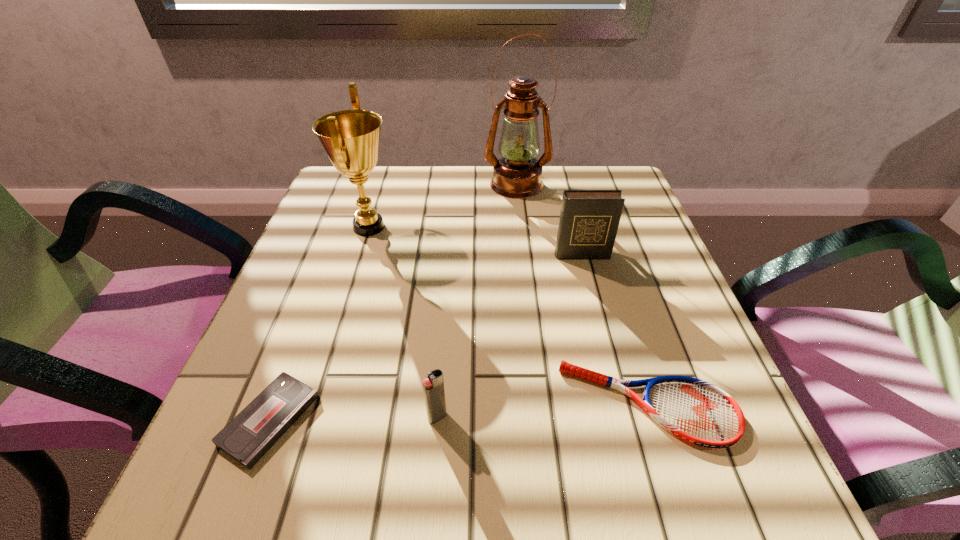
You are a GUI agent. You are given a task and a screenshot of the screen. Output one action in this format:
    pyautogui.click(x=<x>, y=<y>)
    Task: Click on the diary located in the right edge section of the desktop
    The width and height of the screenshot is (960, 540).
    Given the screenshot: What is the action you would take?
    click(589, 219)

At what (x,y) coordinates should I click in order to perform the action: click on tennis racket that is positioned at the right edge. Please return your answer as a coordinate pair (x, y). Looking at the image, I should click on (698, 412).

At what (x,y) coordinates should I click in order to perform the action: click on object that is at the far left corner. Please return your answer as a coordinate pair (x, y). The height and width of the screenshot is (540, 960). Looking at the image, I should click on (351, 138).

Find the location of `object positioned at the near left corner`. object positioned at the near left corner is located at coordinates (246, 438).

Find the location of `object present at the near right corner`. object present at the near right corner is located at coordinates (698, 412).

You are a GUI agent. You are given a task and a screenshot of the screen. Output one action in this format:
    pyautogui.click(x=<x>, y=<y>)
    Task: Click on the vacant space at the far edge of the desktop
    The height and width of the screenshot is (540, 960).
    Given the screenshot: What is the action you would take?
    pyautogui.click(x=420, y=176)

Where is `vacant space at the near edge`? This screenshot has width=960, height=540. vacant space at the near edge is located at coordinates (479, 503).

The height and width of the screenshot is (540, 960). What are the coordinates of `free region at the left edge of the desktop` in the screenshot? It's located at click(294, 307).

In the image, there is a desktop. Where is `vacant space at the right edge`? The image size is (960, 540). vacant space at the right edge is located at coordinates (637, 362).

The width and height of the screenshot is (960, 540). In order to click on vacant space at the far left corner of the desktop in this screenshot , I will do `click(325, 207)`.